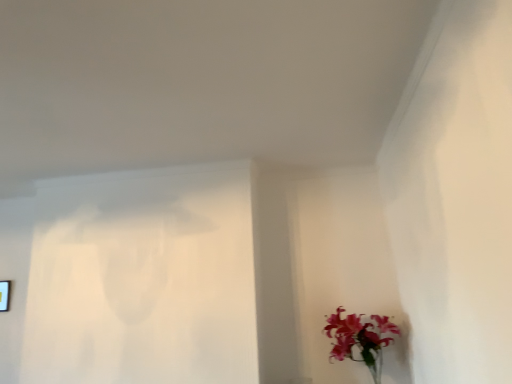
What do you see at coordinates (358, 336) in the screenshot? The image size is (512, 384). I see `pink glossy flowers at lower right` at bounding box center [358, 336].

Image resolution: width=512 pixels, height=384 pixels. Identify the location of pink glossy flowers at lower right. (358, 336).

Locate an element on the screen. This screenshot has height=384, width=512. pink glossy flowers at lower right is located at coordinates (358, 336).